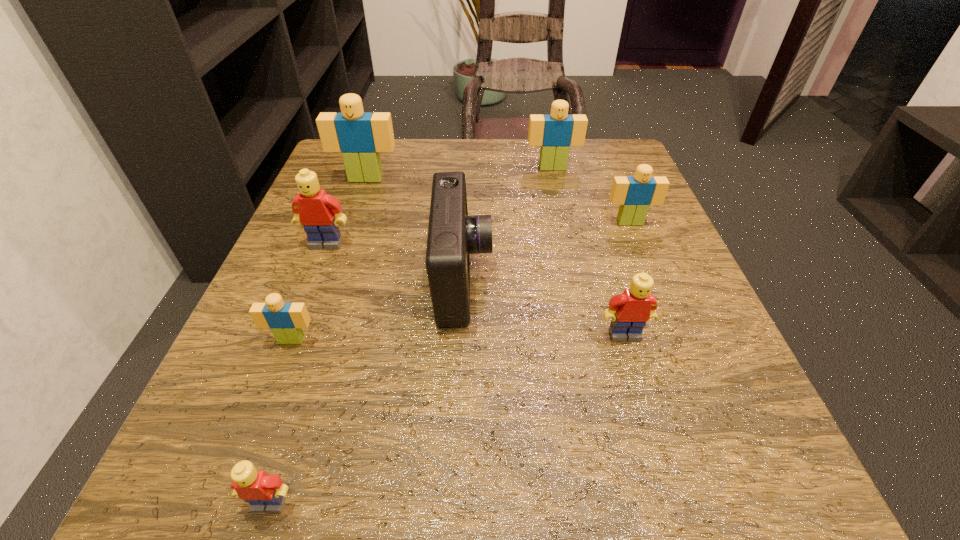
Locate an element on the screen. The width and height of the screenshot is (960, 540). free space at the far left corner of the desktop is located at coordinates (388, 153).

Image resolution: width=960 pixels, height=540 pixels. In the image, there is a desktop. What are the coordinates of `free space at the far right corner` in the screenshot? It's located at (624, 170).

Locate an element on the screen. The height and width of the screenshot is (540, 960). vacant region at the near right corner of the desktop is located at coordinates (770, 463).

Locate an element on the screen. The width and height of the screenshot is (960, 540). vacant area that lies between the nearest object and the fifth object from left to right is located at coordinates (367, 392).

In order to click on unoccupied position between the blue camera and the smallest beige Lego in this screenshot , I will do `click(377, 310)`.

You are a GUI agent. You are given a task and a screenshot of the screen. Output one action in this format:
    pyautogui.click(x=<x>, y=<y>)
    Task: Click on the empty location between the third farthest beige Lego and the third beige Lego from left to right
    This screenshot has width=960, height=540.
    Given the screenshot: What is the action you would take?
    pyautogui.click(x=591, y=195)

Identify the location of unoccupied area between the fourth object from right to left and the farthest object. (508, 224).

Locate an element on the screen. This screenshot has width=960, height=540. vacant point located between the farthest object and the blue camera is located at coordinates pyautogui.click(x=508, y=224).

Identify the location of vacant space that is in between the farthest yellow Lego and the nearest beige Lego. This screenshot has width=960, height=540. (309, 292).

Where is `free space between the farthest beige Lego and the smallest beige Lego`? free space between the farthest beige Lego and the smallest beige Lego is located at coordinates (422, 254).